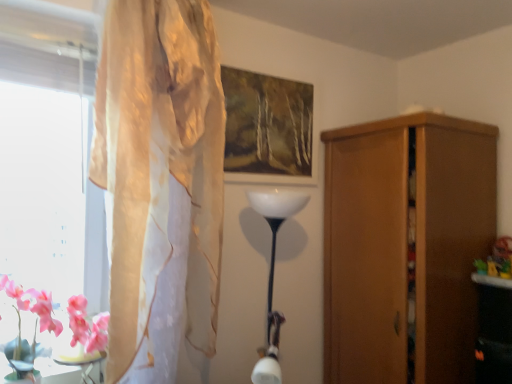
The width and height of the screenshot is (512, 384). What do you see at coordinates (87, 326) in the screenshot?
I see `pink silk flowers at lower left` at bounding box center [87, 326].

What do you see at coordinates (160, 183) in the screenshot? I see `translucent beige curtain at left` at bounding box center [160, 183].

In order to face translucent beige curtain at left, should I rotate leftwards or rightwards?

Rotate your view left by about 12.960°.

The image size is (512, 384). What do you see at coordinates (80, 371) in the screenshot?
I see `pink glossy table at lower left` at bounding box center [80, 371].

What do you see at coordinates (405, 246) in the screenshot? I see `wooden cupboard at right` at bounding box center [405, 246].

Locate an element on the screen. Image resolution: width=512 pixels, height=384 pixels. pink silk flowers at lower left is located at coordinates (87, 326).

From the picture: Can you confirm if matte wooden picture frame at upper center is taller than pink silk flowers at lower left?

Indeed, matte wooden picture frame at upper center has a greater height compared to pink silk flowers at lower left.

Which of these two, matte wooden picture frame at upper center or pink silk flowers at lower left, is wider?

pink silk flowers at lower left is wider.

How different are the orientations of matte wooden picture frame at upper center and pink silk flowers at lower left in degrees?

4.1 degrees separate the facing orientations of matte wooden picture frame at upper center and pink silk flowers at lower left.

Considering the positions of point (240, 124) and point (31, 290), is point (240, 124) closer or farther from the camera than point (31, 290)?

Point (240, 124) is farther from the camera than point (31, 290).

Considering the positions of objects pink glossy table at lower left and pink silk flowers at lower left in the image provided, who is more to the left, pink glossy table at lower left or pink silk flowers at lower left?

Positioned to the left is pink silk flowers at lower left.

Identify the location of table that appears below the pink silk flowers at lower left (from the image's perspective). (80, 371).

Who is taller, pink glossy table at lower left or pink silk flowers at lower left?

With more height is pink silk flowers at lower left.

From a real-world perspective, between translucent beige curtain at left and matte wooden picture frame at upper center, who is vertically lower?

translucent beige curtain at left.

Is translucent beige curtain at left facing away from matte wooden picture frame at upper center?

No, translucent beige curtain at left's orientation is not away from matte wooden picture frame at upper center.

Is point (150, 200) farther from camera compared to point (253, 153)?

No.

This screenshot has height=384, width=512. Find the location of `picture frame lying above the translucent beige curtain at left (from the image's perspective)`. picture frame lying above the translucent beige curtain at left (from the image's perspective) is located at coordinates (267, 128).

Which object is further away from the camera, pink glossy table at lower left or translucent beige curtain at left?

Positioned behind is pink glossy table at lower left.

Does point (55, 381) come closer to viewer compared to point (149, 53)?

No, it is not.

Based on their sizes in the image, would you say pink glossy table at lower left is bigger or smaller than translucent beige curtain at left?

Considering their sizes, pink glossy table at lower left takes up less space than translucent beige curtain at left.

Looking at the image, does pink silk flowers at lower left seem bigger or smaller compared to matte wooden picture frame at upper center?

Clearly, pink silk flowers at lower left is larger in size than matte wooden picture frame at upper center.

From a real-world perspective, does pink silk flowers at lower left sit lower than matte wooden picture frame at upper center?

Yes, from a real-world perspective, pink silk flowers at lower left is below matte wooden picture frame at upper center.

I want to click on flower that is in front of the matte wooden picture frame at upper center, so click(x=87, y=326).

Between pink silk flowers at lower left and matte wooden picture frame at upper center, which one has more height?

matte wooden picture frame at upper center.

Does translucent beige curtain at left have a lesser width compared to wooden cupboard at right?

Indeed, translucent beige curtain at left has a lesser width compared to wooden cupboard at right.

What's the angular difference between translucent beige curtain at left and wooden cupboard at right's facing directions?

The angular difference between translucent beige curtain at left and wooden cupboard at right is 90 degrees.

Would you say translucent beige curtain at left is inside or outside wooden cupboard at right?

translucent beige curtain at left exists outside the volume of wooden cupboard at right.

Is translucent beige curtain at left positioned behind wooden cupboard at right?

No, translucent beige curtain at left is in front of wooden cupboard at right.

Considering the relative sizes of wooden cupboard at right and pink glossy table at lower left in the image provided, is wooden cupboard at right shorter than pink glossy table at lower left?

Incorrect, the height of wooden cupboard at right does not fall short of that of pink glossy table at lower left.

Is wooden cupboard at right to the left or to the right of pink glossy table at lower left in the image?

From the image, it's evident that wooden cupboard at right is to the right of pink glossy table at lower left.

From a real-world perspective, is wooden cupboard at right under pink glossy table at lower left?

Incorrect, from a real-world perspective, wooden cupboard at right is higher than pink glossy table at lower left.

Considering the relative sizes of wooden cupboard at right and pink glossy table at lower left in the image provided, is wooden cupboard at right bigger than pink glossy table at lower left?

Yes.

Locate an element on the screen. picture frame that appears above the pink silk flowers at lower left (from the image's perspective) is located at coordinates (267, 128).

Locate an element on the screen. Image resolution: width=512 pixels, height=384 pixels. table to the right of pink silk flowers at lower left is located at coordinates (80, 371).

Estimate the real-world distances between objects in this image. Which object is further from translucent beige curtain at left, pink silk flowers at lower left or matte wooden picture frame at upper center?

matte wooden picture frame at upper center.

When comparing their distances from matte wooden picture frame at upper center, does wooden cupboard at right or pink silk flowers at lower left seem further?

Based on the image, pink silk flowers at lower left appears to be further to matte wooden picture frame at upper center.

Estimate the real-world distances between objects in this image. Which object is closer to matte wooden picture frame at upper center, pink glossy table at lower left or pink silk flowers at lower left?

The object closer to matte wooden picture frame at upper center is pink silk flowers at lower left.

Looking at the image, which one is located further to pink glossy table at lower left, pink silk flowers at lower left or translucent beige curtain at left?

Among the two, translucent beige curtain at left is located further to pink glossy table at lower left.

Based on the photo, estimate the real-world distances between objects in this image. Which object is further from translucent beige curtain at left, pink silk flowers at lower left or pink glossy table at lower left?

pink glossy table at lower left lies further to translucent beige curtain at left than the other object.

Estimate the real-world distances between objects in this image. Which object is further from translucent beige curtain at left, pink silk flowers at lower left or wooden cupboard at right?

wooden cupboard at right is positioned further to the anchor translucent beige curtain at left.

From the image, which object appears to be farther from pink silk flowers at lower left, matte wooden picture frame at upper center or pink glossy table at lower left?

matte wooden picture frame at upper center.

When comparing their distances from pink silk flowers at lower left, does pink glossy table at lower left or translucent beige curtain at left seem closer?

Among the two, pink glossy table at lower left is located nearer to pink silk flowers at lower left.

This screenshot has height=384, width=512. Identify the location of curtain between pink glossy table at lower left and wooden cupboard at right from left to right. (160, 183).

The width and height of the screenshot is (512, 384). Identify the location of curtain between matte wooden picture frame at upper center and pink glossy table at lower left in the up-down direction. (160, 183).

Locate an element on the screen. The height and width of the screenshot is (384, 512). flower between translucent beige curtain at left and pink glossy table at lower left in the up-down direction is located at coordinates (87, 326).

Where is `table between pink silk flowers at lower left and wooden cupboard at right in the horizontal direction`? table between pink silk flowers at lower left and wooden cupboard at right in the horizontal direction is located at coordinates (80, 371).